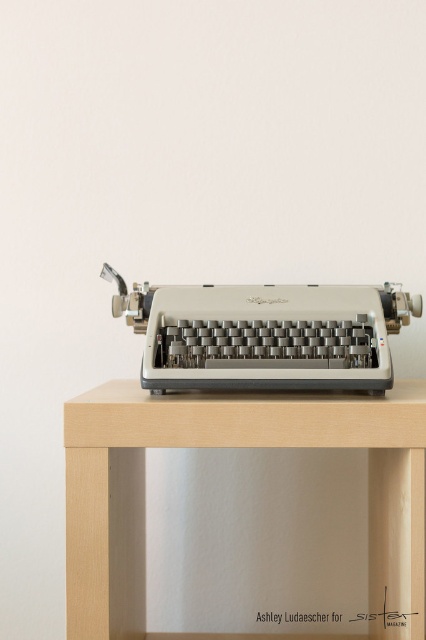
Who is shorter, light wood table at center or matte silver typewriter at center?

With less height is matte silver typewriter at center.

Can you confirm if light wood table at center is positioned to the left of matte silver typewriter at center?

Correct, you'll find light wood table at center to the left of matte silver typewriter at center.

Between point (108, 392) and point (337, 308), which one is positioned behind?

Point (108, 392)

The height and width of the screenshot is (640, 426). In order to click on light wood table at center in this screenshot , I will do `click(233, 445)`.